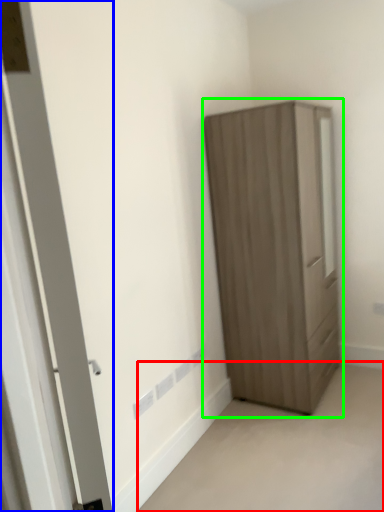
Question: Which object is the farthest from corridor (highlighted by a red box)? Choose among these: door (highlighted by a blue box) or cupboard (highlighted by a green box).

Choices:
 (A) door
 (B) cupboard

Answer: (A)